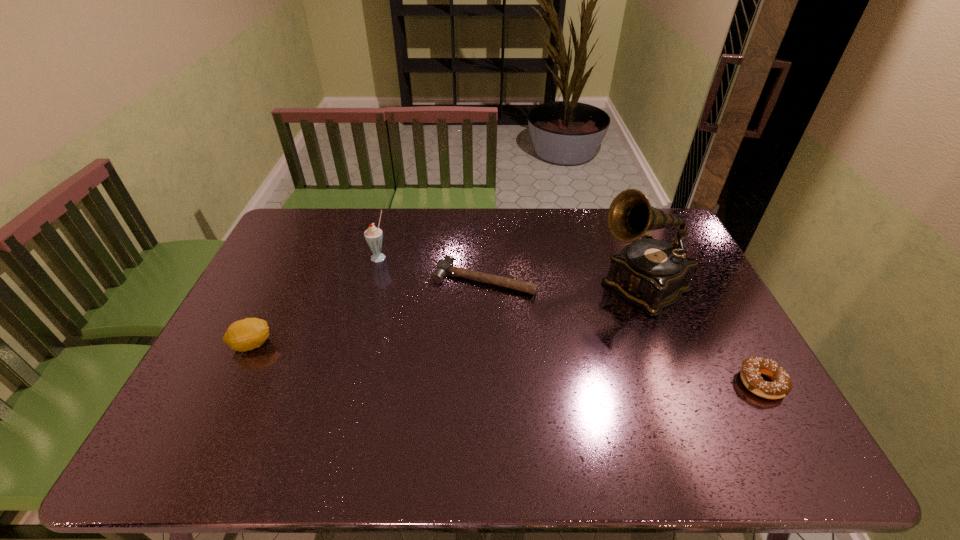
Where is `vacant position in the image that satisfies the following two spatial constraints: 1. on the front side of the fourth shortest object; 2. on the right side of the tallest object`? Image resolution: width=960 pixels, height=540 pixels. vacant position in the image that satisfies the following two spatial constraints: 1. on the front side of the fourth shortest object; 2. on the right side of the tallest object is located at coordinates (371, 286).